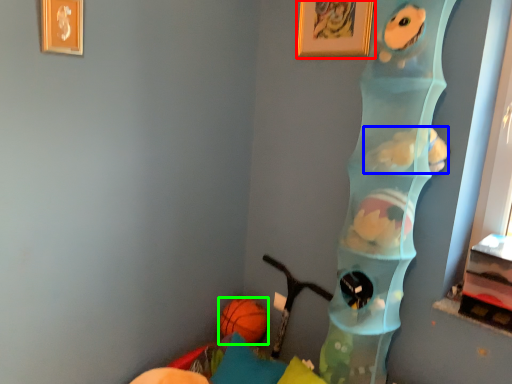
Question: Considering the real-world distances, which object is farthest from picture frame (highlighted by a red box)? animal (highlighted by a blue box) or ball (highlighted by a green box)?

Choices:
 (A) animal
 (B) ball

Answer: (B)